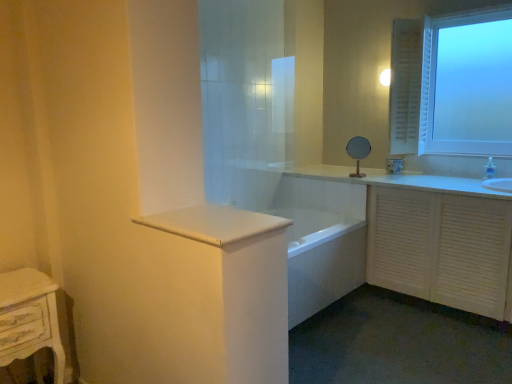
Question: Is white glossy countertop at center smaller than white distressed wood nightstand at lower left?

Choices:
 (A) no
 (B) yes

Answer: (B)

Question: Is the position of white glossy countertop at center less distant than that of white distressed wood nightstand at lower left?

Choices:
 (A) no
 (B) yes

Answer: (B)

Question: Does white glossy countertop at center have a larger size compared to white distressed wood nightstand at lower left?

Choices:
 (A) yes
 (B) no

Answer: (B)

Question: Is white glossy countertop at center outside of white distressed wood nightstand at lower left?

Choices:
 (A) no
 (B) yes

Answer: (B)

Question: Does white glossy countertop at center have a greater height compared to white distressed wood nightstand at lower left?

Choices:
 (A) yes
 (B) no

Answer: (B)

Question: From the image's perspective, is white glossy countertop at center on white distressed wood nightstand at lower left?

Choices:
 (A) yes
 (B) no

Answer: (A)

Question: Is frosted glass window at upper right oriented away from white wooden cabinet at right?

Choices:
 (A) no
 (B) yes

Answer: (A)

Question: From the image's perspective, is frosted glass window at upper right under white wooden cabinet at right?

Choices:
 (A) yes
 (B) no

Answer: (B)

Question: Can you confirm if frosted glass window at upper right is taller than white wooden cabinet at right?

Choices:
 (A) no
 (B) yes

Answer: (B)

Question: Can you confirm if frosted glass window at upper right is positioned to the right of white wooden cabinet at right?

Choices:
 (A) yes
 (B) no

Answer: (A)

Question: From the image's perspective, is frosted glass window at upper right on white wooden cabinet at right?

Choices:
 (A) yes
 (B) no

Answer: (A)

Question: Does frosted glass window at upper right contain white wooden cabinet at right?

Choices:
 (A) yes
 (B) no

Answer: (B)

Question: From a real-world perspective, is white glossy countertop at center physically below white glossy bathtub at center?

Choices:
 (A) yes
 (B) no

Answer: (B)